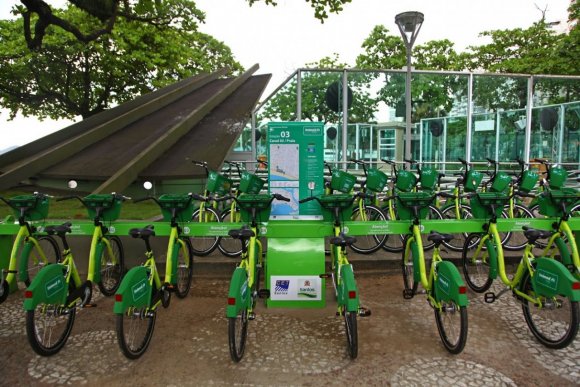
Where is `light designs on the ground`? light designs on the ground is located at coordinates (13, 320), (50, 367), (212, 330), (420, 369), (419, 318), (549, 357).